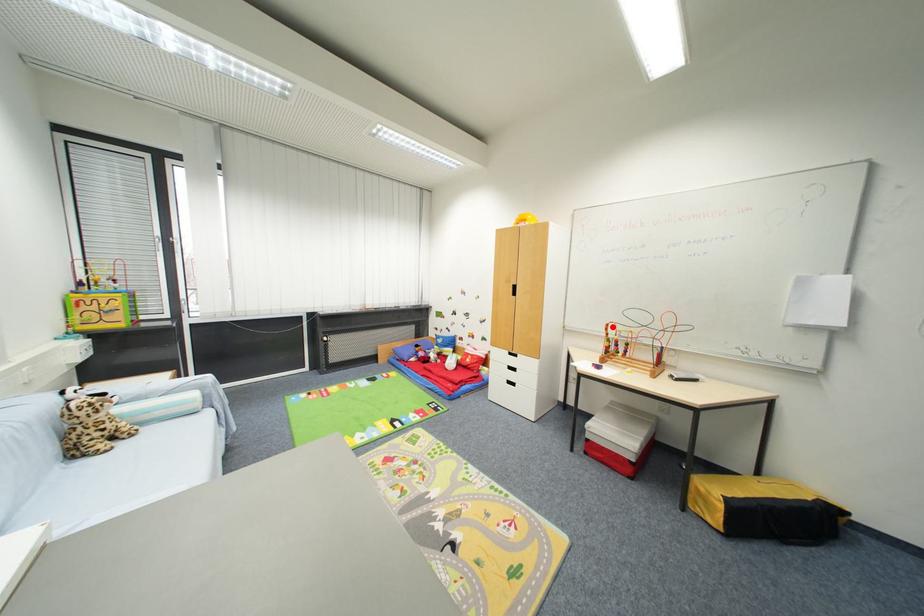
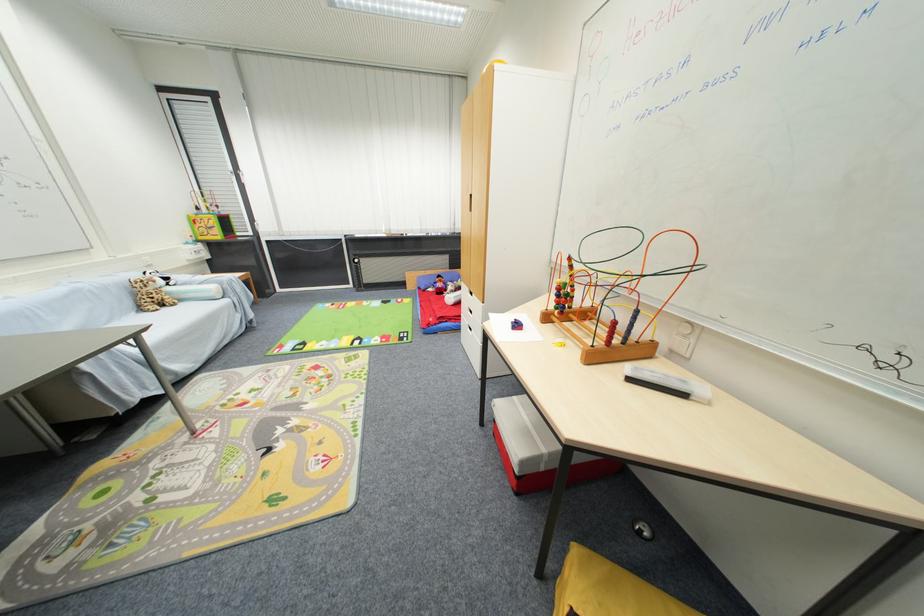
Question: I am providing you with two images of the same scene from different viewpoints. Image1 has a red point marked. In image2, the corresponding 3D location appears at what relative position? Reply with the corresponding letter.

Choices:
 (A) Closer
 (B) Farther

Answer: (A)